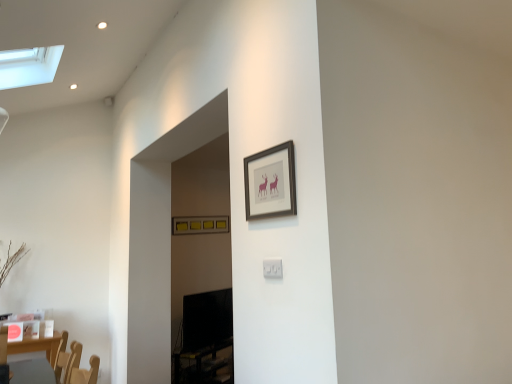
Question: Considering their positions, is white plastic electric outlet at center located in front of or behind matte black frame at upper center, the first picture frame from the right?

Choices:
 (A) front
 (B) behind

Answer: (B)

Question: From their relative heights in the image, would you say white plastic electric outlet at center is taller or shorter than matte black frame at upper center, the first picture frame from the right?

Choices:
 (A) short
 (B) tall

Answer: (A)

Question: Which is farther from the matte yellow picture frame at upper center, which is the 1th picture frame in back-to-front order?

Choices:
 (A) white plastic electric outlet at center
 (B) matte black frame at upper center, which is counted as the 2th picture frame, starting from the back

Answer: (A)

Question: Which object is positioned farthest from the matte black frame at upper center, placed as the 1th picture frame when sorted from front to back?

Choices:
 (A) white plastic electric outlet at center
 (B) matte yellow picture frame at upper center, which is the second picture frame in front-to-back order

Answer: (B)